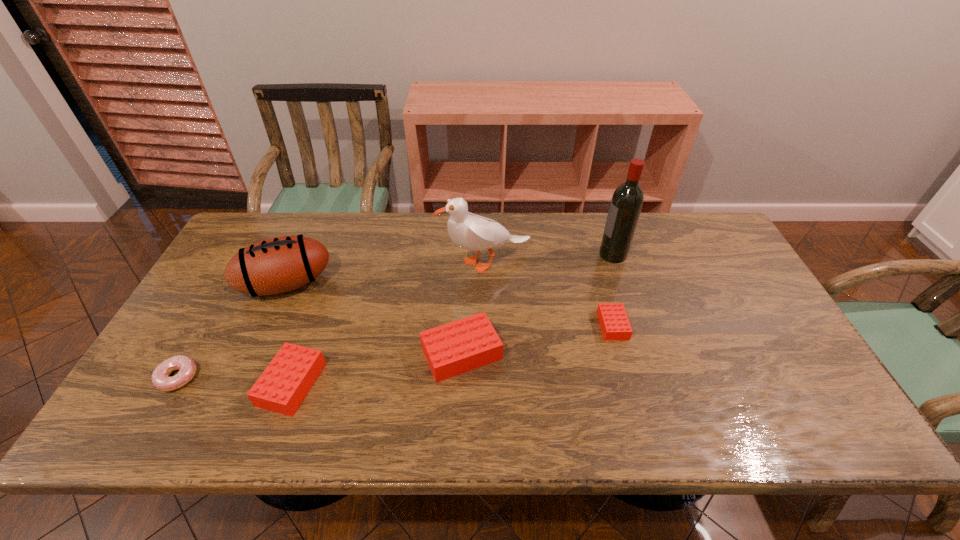
Locate an element on the screen. The height and width of the screenshot is (540, 960). wine bottle at the far edge is located at coordinates (627, 200).

Locate an element on the screen. Image resolution: width=960 pixels, height=540 pixels. doughnut situated at the near edge is located at coordinates (160, 378).

Where is `football (American) that is at the left edge`? Image resolution: width=960 pixels, height=540 pixels. football (American) that is at the left edge is located at coordinates (276, 265).

Find the location of a particular element. The height and width of the screenshot is (540, 960). doughnut positioned at the left edge is located at coordinates (160, 378).

The height and width of the screenshot is (540, 960). What are the coordinates of `object situated at the near left corner` in the screenshot? It's located at (160, 378).

Find the location of a particular element. Image resolution: width=960 pixels, height=540 pixels. free space at the far edge of the desktop is located at coordinates [x=523, y=227].

This screenshot has width=960, height=540. In order to click on vacant area at the near edge of the desktop in this screenshot , I will do `click(612, 382)`.

The height and width of the screenshot is (540, 960). In order to click on vacant space at the right edge in this screenshot , I will do `click(697, 277)`.

At what (x,y) coordinates should I click in order to perform the action: click on free space at the far left corner of the desktop. Please return your answer as a coordinate pair (x, y). The image size is (960, 540). Looking at the image, I should click on (252, 218).

I want to click on vacant space in between the rightmost Lego and the fifth shortest object, so click(449, 305).